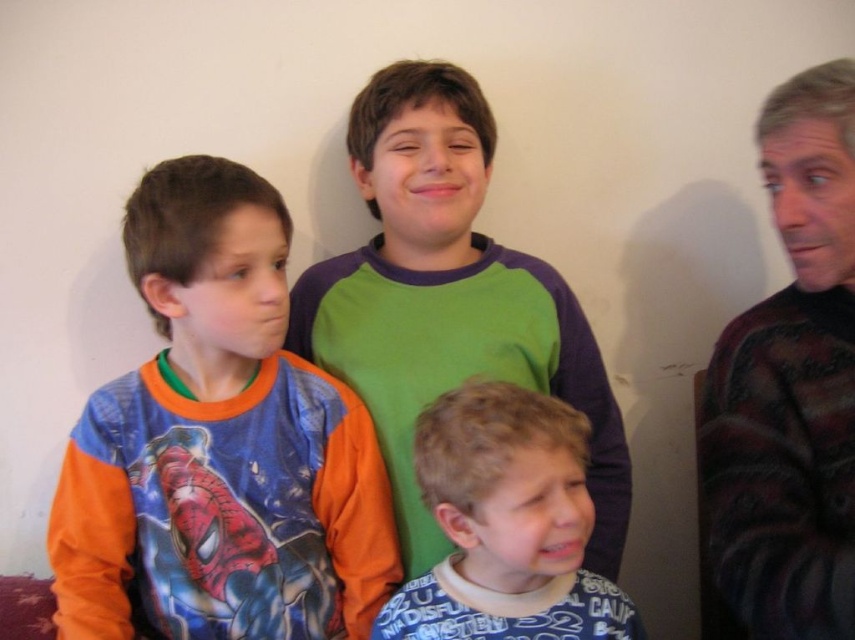
Question: Does matte orange long-sleeve shirt at left have a greater width compared to blue cotton shirt at lower center?

Choices:
 (A) no
 (B) yes

Answer: (B)

Question: Which object is farther from the camera taking this photo?

Choices:
 (A) dark maroon sweater at right
 (B) blue cotton shirt at lower center
 (C) green soft shirt at center
 (D) matte orange long-sleeve shirt at left

Answer: (C)

Question: Is green soft shirt at center positioned behind dark maroon sweater at right?

Choices:
 (A) yes
 (B) no

Answer: (A)

Question: In this image, where is dark maroon sweater at right located relative to blue cotton shirt at lower center?

Choices:
 (A) right
 (B) left

Answer: (A)

Question: Estimate the real-world distances between objects in this image. Which object is closer to the green soft shirt at center?

Choices:
 (A) matte orange long-sleeve shirt at left
 (B) dark maroon sweater at right

Answer: (A)

Question: Which object is positioned farthest from the dark maroon sweater at right?

Choices:
 (A) green soft shirt at center
 (B) matte orange long-sleeve shirt at left

Answer: (B)